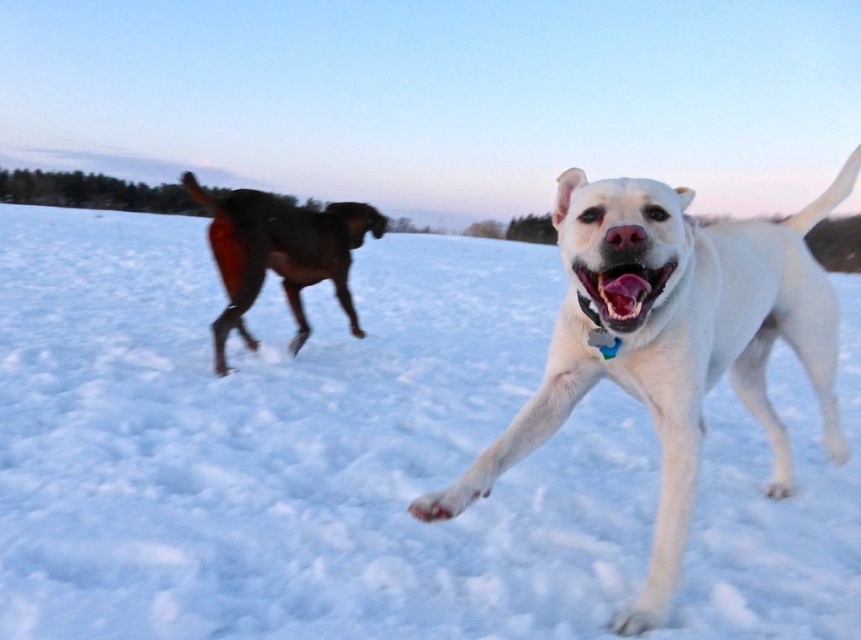
Question: Which point is closer to the camera taking this photo?

Choices:
 (A) (325, 275)
 (B) (692, 419)
 (C) (614, 417)

Answer: (B)

Question: Is the position of white glossy dog at center more distant than that of shiny brown dog at left?

Choices:
 (A) no
 (B) yes

Answer: (A)

Question: Can you confirm if white glossy dog at center is thinner than shiny brown dog at left?

Choices:
 (A) no
 (B) yes

Answer: (A)

Question: Which of the following is the farthest from the observer?

Choices:
 (A) (550, 300)
 (B) (586, 282)
 (C) (321, 250)

Answer: (A)

Question: Which of the following is the closest to the observer?

Choices:
 (A) white glossy dog at center
 (B) white fluffy snow at center

Answer: (A)

Question: Is white fluffy snow at center smaller than white glossy dog at center?

Choices:
 (A) no
 (B) yes

Answer: (A)